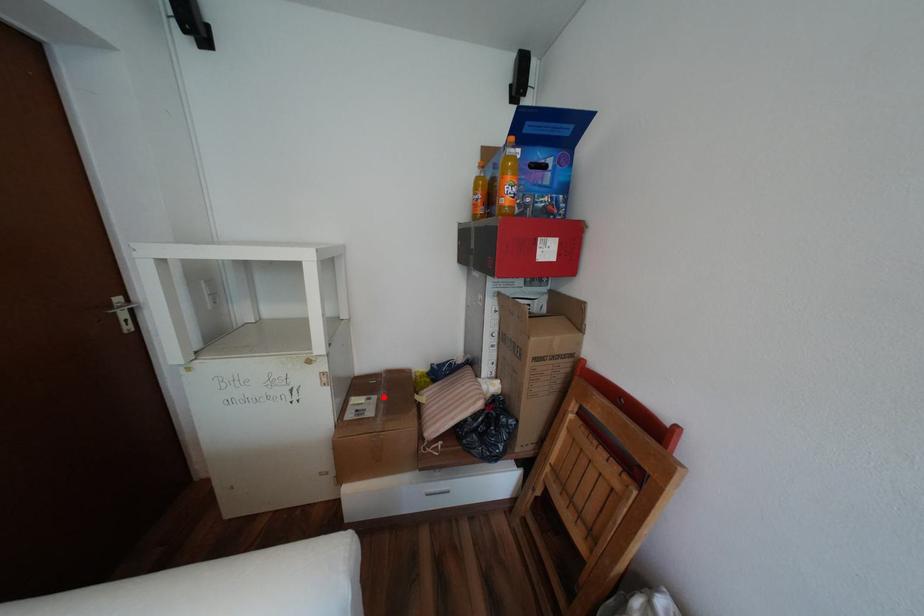
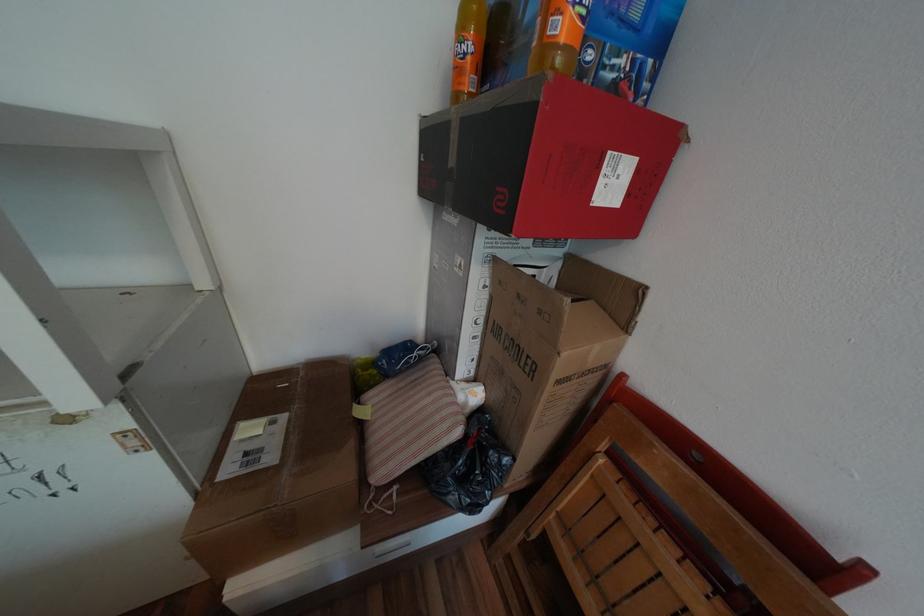
Where in the second image is the point corresponding to the highlighted location from the first image?

(293, 416)